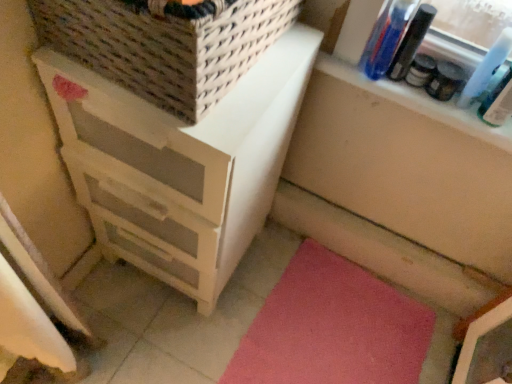
Image resolution: width=512 pixels, height=384 pixels. Find the location of `free space in front of white wood chest of drawers at left`. free space in front of white wood chest of drawers at left is located at coordinates (147, 333).